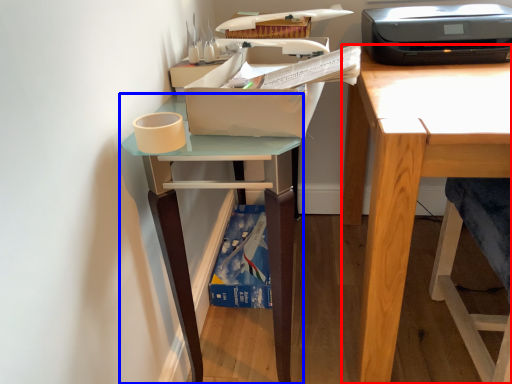
Question: Which object appears closest to the camera in this image, desk (highlighted by a red box) or table (highlighted by a blue box)?

Choices:
 (A) desk
 (B) table

Answer: (A)